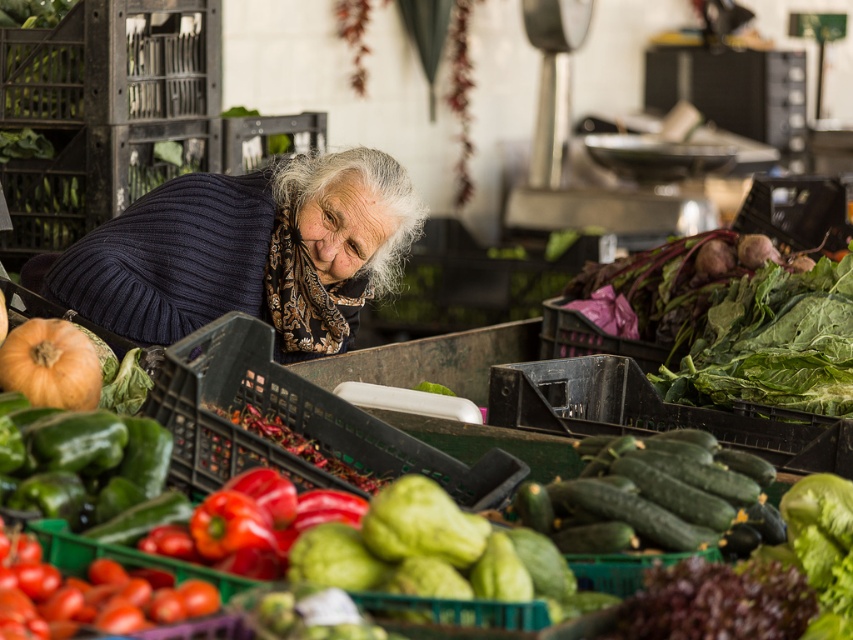
What do you see at coordinates (248, 252) in the screenshot? Image resolution: width=853 pixels, height=640 pixels. I see `knitted dark blue sweater at center` at bounding box center [248, 252].

Can you confirm if knitted dark blue sweater at center is positioned to the left of green leafy at center?

Indeed, knitted dark blue sweater at center is positioned on the left side of green leafy at center.

Does point (200, 250) come closer to viewer compared to point (735, 301)?

Yes, point (200, 250) is closer to viewer.

I want to click on knitted dark blue sweater at center, so click(248, 252).

How distant is green leafy at center from orange matte pumpkin at lower left?

A distance of 2.17 meters exists between green leafy at center and orange matte pumpkin at lower left.

Does green leafy at center appear on the left side of orange matte pumpkin at lower left?

In fact, green leafy at center is to the right of orange matte pumpkin at lower left.

Which is behind, point (743, 275) or point (6, 387)?

Point (743, 275)

Where is `green leafy at center`? green leafy at center is located at coordinates (773, 342).

Can you confirm if knitted dark blue sweater at center is wider than orange matte pumpkin at lower left?

Correct, the width of knitted dark blue sweater at center exceeds that of orange matte pumpkin at lower left.

Between knitted dark blue sweater at center and orange matte pumpkin at lower left, which one appears on the left side from the viewer's perspective?

orange matte pumpkin at lower left is more to the left.

What do you see at coordinates (248, 252) in the screenshot? The image size is (853, 640). I see `knitted dark blue sweater at center` at bounding box center [248, 252].

Locate an element on the screen. knitted dark blue sweater at center is located at coordinates (248, 252).